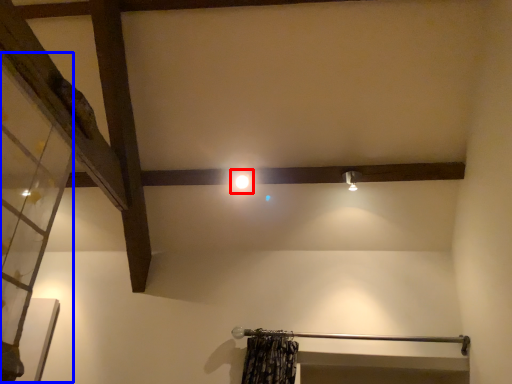
Question: Which object appears closest to the camera in this image, light (highlighted by a red box) or glass door (highlighted by a blue box)?

Choices:
 (A) light
 (B) glass door

Answer: (B)